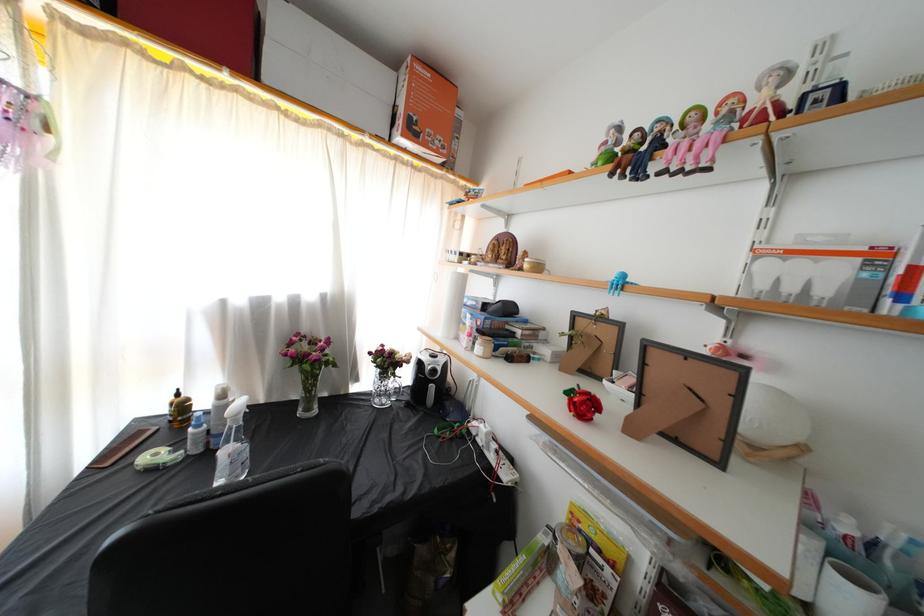
Identify the location of white spray bottle trigger. The height and width of the screenshot is (616, 924). (236, 411).